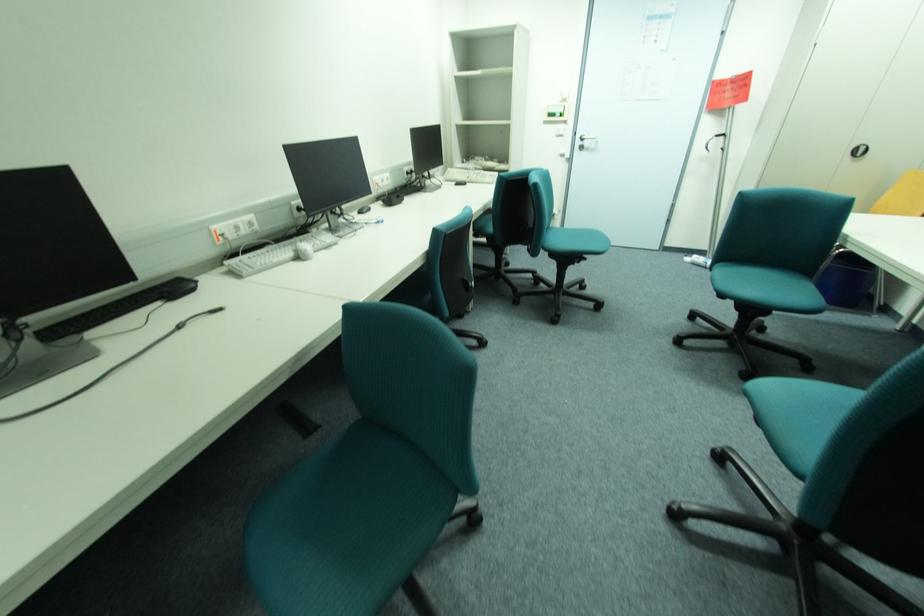
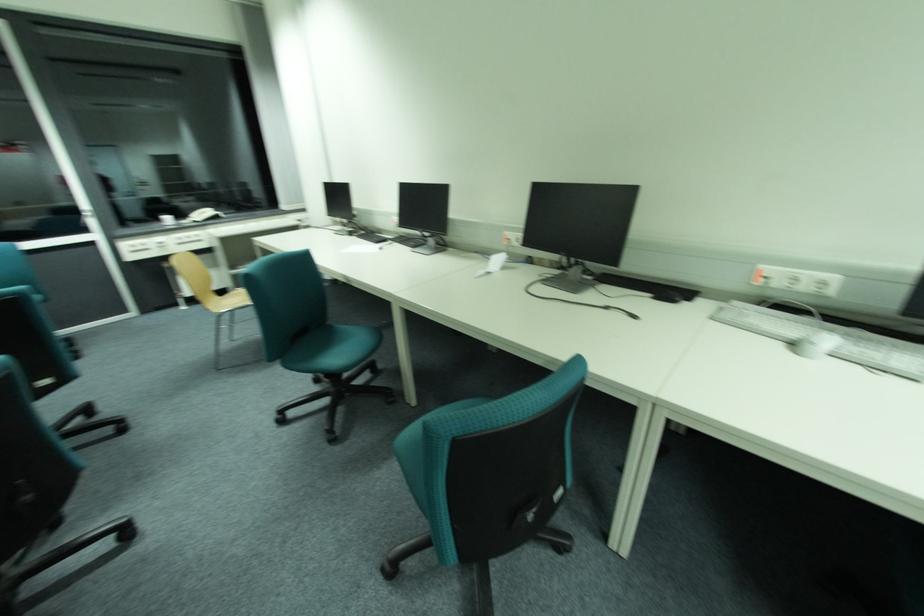
The images are taken continuously from a first-person perspective. In which direction is your viewpoint rotating?

The camera's rotation is toward left-down.